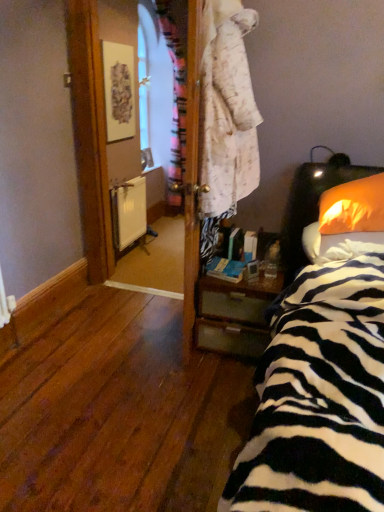
The height and width of the screenshot is (512, 384). Describe the element at coordinates (353, 207) in the screenshot. I see `orange fabric pillow at right, the second pillow in the bottom-to-top sequence` at that location.

This screenshot has height=512, width=384. Describe the element at coordinates (339, 244) in the screenshot. I see `orange fabric pillow at right, which is the second pillow in top-to-bottom order` at that location.

Describe the element at coordinates (234, 315) in the screenshot. This screenshot has height=512, width=384. I see `wooden nightstand at lower right` at that location.

Identify the location of orange fabric pillow at right, the second pillow in the bottom-to-top sequence. (353, 207).

There is a white matte radiator at center. Identify the location of the 1st pillow above it (from a real-world perspective). (339, 244).

From a real-world perspective, is orange fabric pillow at right, which is the second pillow in top-to-bottom order, on white matte radiator at center?

Indeed, from a real-world perspective, orange fabric pillow at right, which is the second pillow in top-to-bottom order, stands above white matte radiator at center.

From the image's perspective, which one is positioned higher, orange fabric pillow at right, placed as the first pillow when sorted from bottom to top, or white matte radiator at center?

white matte radiator at center appears higher in the image.

Looking at this image, is orange fabric pillow at right, which is the second pillow in top-to-bottom order, bigger than white matte radiator at center?

Indeed, orange fabric pillow at right, which is the second pillow in top-to-bottom order, has a larger size compared to white matte radiator at center.

Where is `nightstand on the left of orange fabric pillow at right, the 1th pillow in the top-to-bottom sequence`? This screenshot has height=512, width=384. nightstand on the left of orange fabric pillow at right, the 1th pillow in the top-to-bottom sequence is located at coordinates (234, 315).

Considering the relative sizes of orange fabric pillow at right, the second pillow in the bottom-to-top sequence, and wooden nightstand at lower right in the image provided, is orange fabric pillow at right, the second pillow in the bottom-to-top sequence, bigger than wooden nightstand at lower right?

No.

From a real-world perspective, is orange fabric pillow at right, the second pillow in the bottom-to-top sequence, below wooden nightstand at lower right?

No, from a real-world perspective, orange fabric pillow at right, the second pillow in the bottom-to-top sequence, is not below wooden nightstand at lower right.

Is point (361, 218) closer to viewer compared to point (202, 307)?

Yes.

Does orange fabric pillow at right, placed as the first pillow when sorted from bottom to top, have a lesser height compared to wooden nightstand at lower right?

Indeed, orange fabric pillow at right, placed as the first pillow when sorted from bottom to top, has a lesser height compared to wooden nightstand at lower right.

Based on their sizes in the image, would you say orange fabric pillow at right, placed as the first pillow when sorted from bottom to top, is bigger or smaller than wooden nightstand at lower right?

Clearly, orange fabric pillow at right, placed as the first pillow when sorted from bottom to top, is smaller in size than wooden nightstand at lower right.

Can you tell me how much orange fabric pillow at right, placed as the first pillow when sorted from bottom to top, and wooden nightstand at lower right differ in facing direction?

0.468 degrees separate the facing orientations of orange fabric pillow at right, placed as the first pillow when sorted from bottom to top, and wooden nightstand at lower right.

Is orange fabric pillow at right, placed as the first pillow when sorted from bottom to top, to the right of wooden nightstand at lower right from the viewer's perspective?

Indeed, orange fabric pillow at right, placed as the first pillow when sorted from bottom to top, is positioned on the right side of wooden nightstand at lower right.

Can you tell me how much orange fabric pillow at right, the second pillow in the bottom-to-top sequence, and zebra-patterned fabric at right differ in facing direction?

There is a 1.72-degree angle between the facing directions of orange fabric pillow at right, the second pillow in the bottom-to-top sequence, and zebra-patterned fabric at right.

Considering the relative positions of orange fabric pillow at right, the 1th pillow in the top-to-bottom sequence, and zebra-patterned fabric at right in the image provided, is orange fabric pillow at right, the 1th pillow in the top-to-bottom sequence, to the right of zebra-patterned fabric at right from the viewer's perspective?

Indeed, orange fabric pillow at right, the 1th pillow in the top-to-bottom sequence, is positioned on the right side of zebra-patterned fabric at right.

Looking at this image, from a real-world perspective, between orange fabric pillow at right, the second pillow in the bottom-to-top sequence, and zebra-patterned fabric at right, who is vertically higher?

orange fabric pillow at right, the second pillow in the bottom-to-top sequence, is physically above.

Considering the relative sizes of orange fabric pillow at right, the second pillow in the bottom-to-top sequence, and zebra-patterned fabric at right in the image provided, is orange fabric pillow at right, the second pillow in the bottom-to-top sequence, wider than zebra-patterned fabric at right?

No, orange fabric pillow at right, the second pillow in the bottom-to-top sequence, is not wider than zebra-patterned fabric at right.

Does point (250, 300) lie behind point (325, 228)?

Yes, it is.

Where is `the 2nd pillow to the right when counting from the wooden nightstand at lower right`? Image resolution: width=384 pixels, height=512 pixels. the 2nd pillow to the right when counting from the wooden nightstand at lower right is located at coordinates (353, 207).

Considering the relative positions of wooden nightstand at lower right and orange fabric pillow at right, the 1th pillow in the top-to-bottom sequence, in the image provided, is wooden nightstand at lower right to the right of orange fabric pillow at right, the 1th pillow in the top-to-bottom sequence, from the viewer's perspective?

In fact, wooden nightstand at lower right is to the left of orange fabric pillow at right, the 1th pillow in the top-to-bottom sequence.

Is wooden nightstand at lower right directly adjacent to orange fabric pillow at right, the 1th pillow in the top-to-bottom sequence?

wooden nightstand at lower right and orange fabric pillow at right, the 1th pillow in the top-to-bottom sequence, are not in contact.

Is white matte radiator at center positioned behind orange fabric pillow at right, the second pillow in the bottom-to-top sequence?

Yes, it is behind orange fabric pillow at right, the second pillow in the bottom-to-top sequence.

From the picture: Who is bigger, white matte radiator at center or orange fabric pillow at right, the second pillow in the bottom-to-top sequence?

With larger size is orange fabric pillow at right, the second pillow in the bottom-to-top sequence.

From a real-world perspective, is white matte radiator at center on top of orange fabric pillow at right, the second pillow in the bottom-to-top sequence?

No, from a real-world perspective, white matte radiator at center is not over orange fabric pillow at right, the second pillow in the bottom-to-top sequence

Is white matte radiator at center spatially inside orange fabric pillow at right, the second pillow in the bottom-to-top sequence, or outside of it?

white matte radiator at center exists outside the volume of orange fabric pillow at right, the second pillow in the bottom-to-top sequence.

From the image's perspective, is zebra-patterned fabric at right above or below orange fabric pillow at right, which is the second pillow in top-to-bottom order?

From the image's perspective, zebra-patterned fabric at right appears below orange fabric pillow at right, which is the second pillow in top-to-bottom order.

Is point (258, 413) positioned in front of point (303, 229)?

That is True.

Is zebra-patterned fabric at right inside the boundaries of orange fabric pillow at right, placed as the first pillow when sorted from bottom to top, or outside?

zebra-patterned fabric at right cannot be found inside orange fabric pillow at right, placed as the first pillow when sorted from bottom to top.

Is zebra-patterned fabric at right closer to the viewer compared to orange fabric pillow at right, which is the second pillow in top-to-bottom order?

Yes, it is.

This screenshot has height=512, width=384. There is a white matte radiator at center. Identify the location of the 2nd pillow below it (from the image's perspective). point(339,244).

From a real-world perspective, which pillow is the 2nd one above the wooden nightstand at lower right? Please provide its 2D coordinates.

[(353, 207)]

When comparing their distances from orange fabric pillow at right, placed as the first pillow when sorted from bottom to top, does orange fabric pillow at right, the second pillow in the bottom-to-top sequence, or white matte radiator at center seem further?

white matte radiator at center lies further to orange fabric pillow at right, placed as the first pillow when sorted from bottom to top, than the other object.

From the image, which object appears to be nearer to orange fabric pillow at right, the second pillow in the bottom-to-top sequence, zebra-patterned fabric at right or white matte radiator at center?

zebra-patterned fabric at right is closer to orange fabric pillow at right, the second pillow in the bottom-to-top sequence.

When comparing their distances from zebra-patterned fabric at right, does white matte radiator at center or orange fabric pillow at right, the second pillow in the bottom-to-top sequence, seem further?

white matte radiator at center is further to zebra-patterned fabric at right.

Estimate the real-world distances between objects in this image. Which object is closer to orange fabric pillow at right, which is the second pillow in top-to-bottom order, white matte radiator at center or orange fabric pillow at right, the second pillow in the bottom-to-top sequence?

orange fabric pillow at right, the second pillow in the bottom-to-top sequence.

Looking at this image, estimate the real-world distances between objects in this image. Which object is further from orange fabric pillow at right, the second pillow in the bottom-to-top sequence, wooden nightstand at lower right or orange fabric pillow at right, placed as the first pillow when sorted from bottom to top?

wooden nightstand at lower right is further to orange fabric pillow at right, the second pillow in the bottom-to-top sequence.

Based on their spatial positions, is zebra-patterned fabric at right or wooden nightstand at lower right further from orange fabric pillow at right, the second pillow in the bottom-to-top sequence?

Based on the image, wooden nightstand at lower right appears to be further to orange fabric pillow at right, the second pillow in the bottom-to-top sequence.

Which object lies further to the anchor point orange fabric pillow at right, the 1th pillow in the top-to-bottom sequence, white matte radiator at center or orange fabric pillow at right, placed as the first pillow when sorted from bottom to top?

Among the two, white matte radiator at center is located further to orange fabric pillow at right, the 1th pillow in the top-to-bottom sequence.

When comparing their distances from wooden nightstand at lower right, does orange fabric pillow at right, which is the second pillow in top-to-bottom order, or zebra-patterned fabric at right seem further?

Among the two, zebra-patterned fabric at right is located further to wooden nightstand at lower right.

The image size is (384, 512). Identify the location of pillow between orange fabric pillow at right, placed as the first pillow when sorted from bottom to top, and white matte radiator at center in the front-back direction. (353, 207).

In order to click on nightstand between zebra-patterned fabric at right and white matte radiator at center from front to back in this screenshot , I will do `click(234, 315)`.

Find the location of a particular element. This screenshot has width=384, height=512. nightstand between orange fabric pillow at right, the 1th pillow in the top-to-bottom sequence, and white matte radiator at center, along the z-axis is located at coordinates (234, 315).

Locate an element on the screen. Image resolution: width=384 pixels, height=512 pixels. nightstand between orange fabric pillow at right, placed as the first pillow when sorted from bottom to top, and white matte radiator at center, along the z-axis is located at coordinates [x=234, y=315].